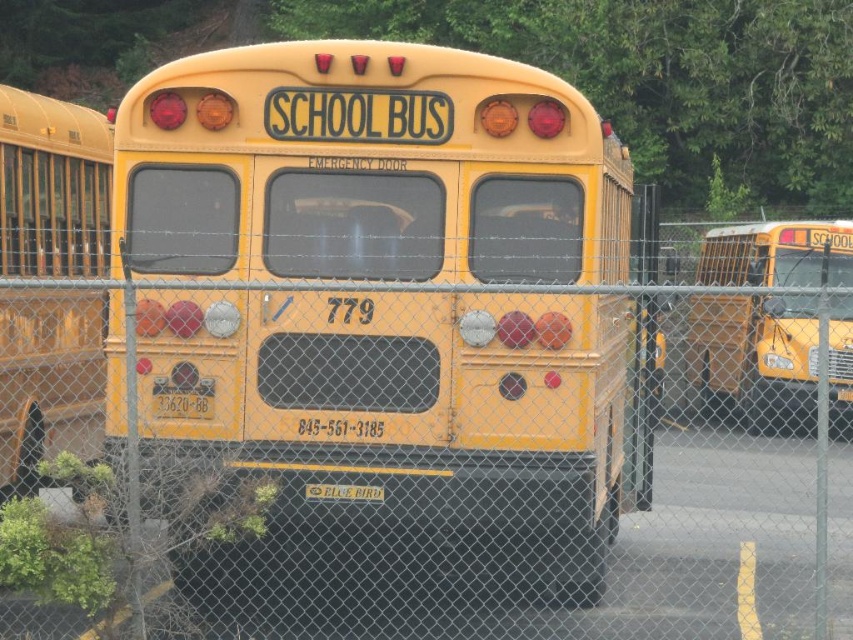
Does metal chain-link fence at center have a lesser width compared to matte yellow school bus at left?

No.

Looking at this image, which is more to the left, metal chain-link fence at center or matte yellow school bus at left?

Positioned to the left is matte yellow school bus at left.

Who is more forward, (318, 515) or (73, 417)?

Positioned in front is point (318, 515).

I want to click on metal chain-link fence at center, so click(x=521, y=547).

Which is below, metal chain-link fence at center or yellow matte school bus at right?

yellow matte school bus at right is lower down.

Is metal chain-link fence at center closer to camera compared to yellow matte school bus at right?

That is False.

Between point (752, 634) and point (791, 364), which one is positioned behind?

The point (791, 364) is more distant.

Find the location of a particular element. Image resolution: width=853 pixels, height=640 pixels. metal chain-link fence at center is located at coordinates (521, 547).

Is yellow matte/solid school bus at center bigger than matte yellow school bus at left?

Indeed, yellow matte/solid school bus at center has a larger size compared to matte yellow school bus at left.

Which is more to the right, yellow matte/solid school bus at center or matte yellow school bus at left?

From the viewer's perspective, yellow matte/solid school bus at center appears more on the right side.

Which is in front, point (273, 180) or point (97, 342)?

Point (273, 180) is more forward.

Where is `yellow matte/solid school bus at center`? The image size is (853, 640). yellow matte/solid school bus at center is located at coordinates (401, 428).